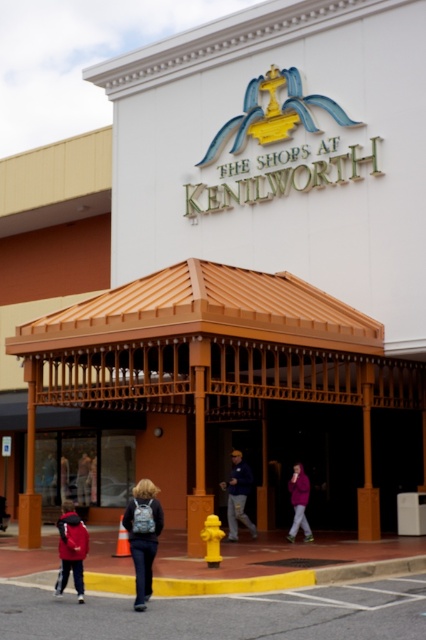
Question: Which point is closer to the camera?

Choices:
 (A) (141, 568)
 (B) (57, 525)
 (C) (232, 476)
 (D) (86, 460)

Answer: (A)

Question: Does denim backpack at center appear under purple fleece jacket at center?

Choices:
 (A) yes
 (B) no

Answer: (A)

Question: Which of these objects is positioned closest to the dark blue jacket at center?

Choices:
 (A) dark blue jeans at center
 (B) denim backpack at center
 (C) purple fleece jacket at center

Answer: (C)

Question: Is dark blue jacket at center to the right of purple fleece jacket at center from the viewer's perspective?

Choices:
 (A) yes
 (B) no

Answer: (B)

Question: From the image, what is the correct spatial relationship of dark blue jacket at center in relation to purple fleece jacket at center?

Choices:
 (A) right
 (B) left

Answer: (B)

Question: Which point is closer to the camera?

Choices:
 (A) purple fleece jacket at center
 (B) dark blue jeans at center

Answer: (A)